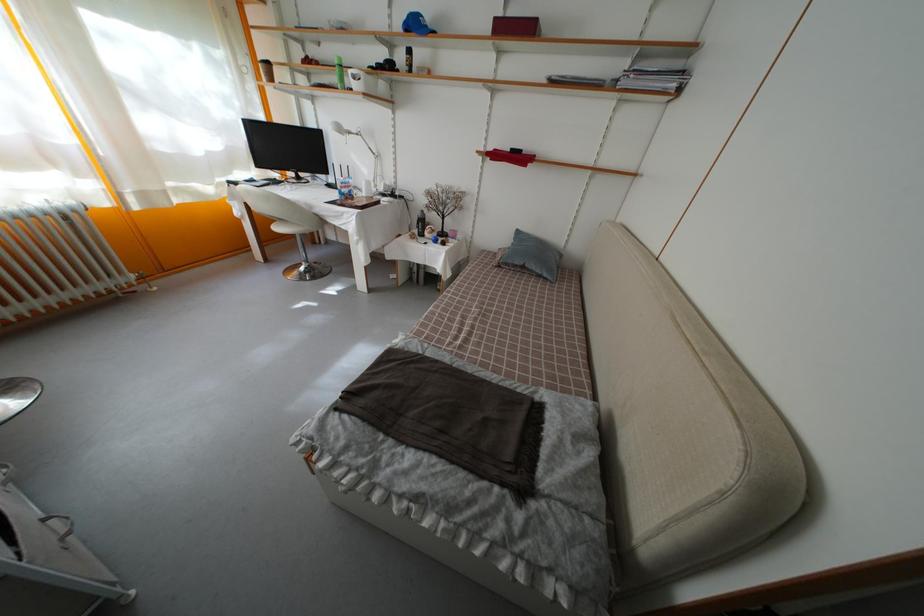
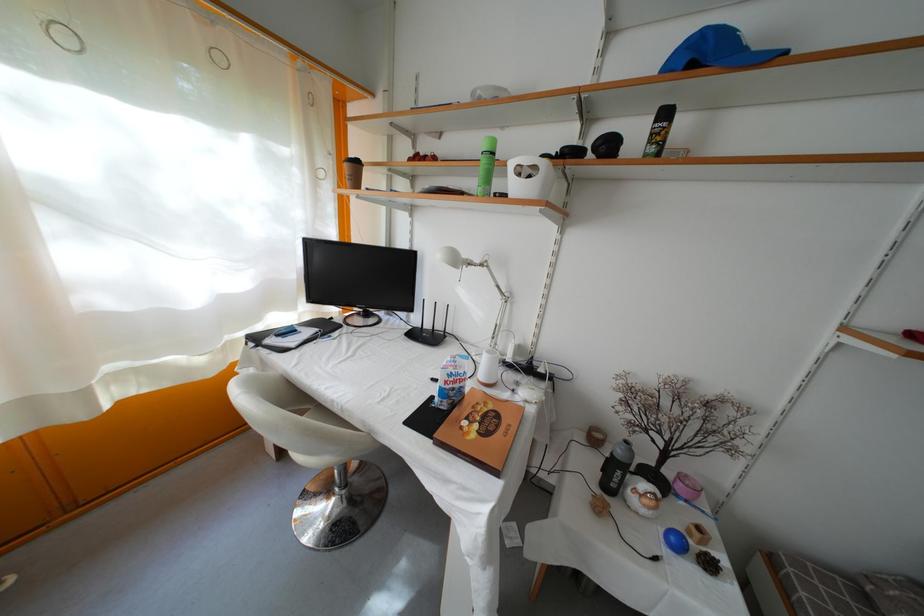
What movement of the cameraman would produce the second image?

The cameraman moved toward left, forward.